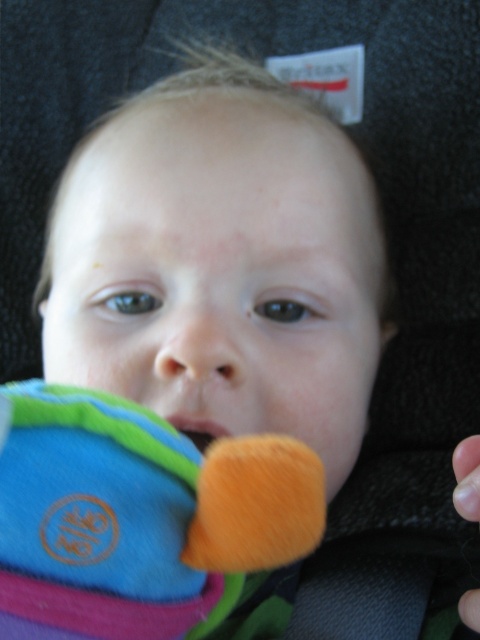
Based on the photo, you are holding a soft plush toy at lower left that is 10.03 inches away from you. Can you reach it if your hand can extend 12 inches?

The soft plush toy at lower left is 10.03 inches away from the viewer, so yes, the hand can reach it since it can extend 12 inches which is further than the distance to the toy.

The baby is holding a soft plush toy at lower left and has a matte orange mouth at center. Which object is wider?

The soft plush toy at lower left is wider than the matte orange mouth at center.